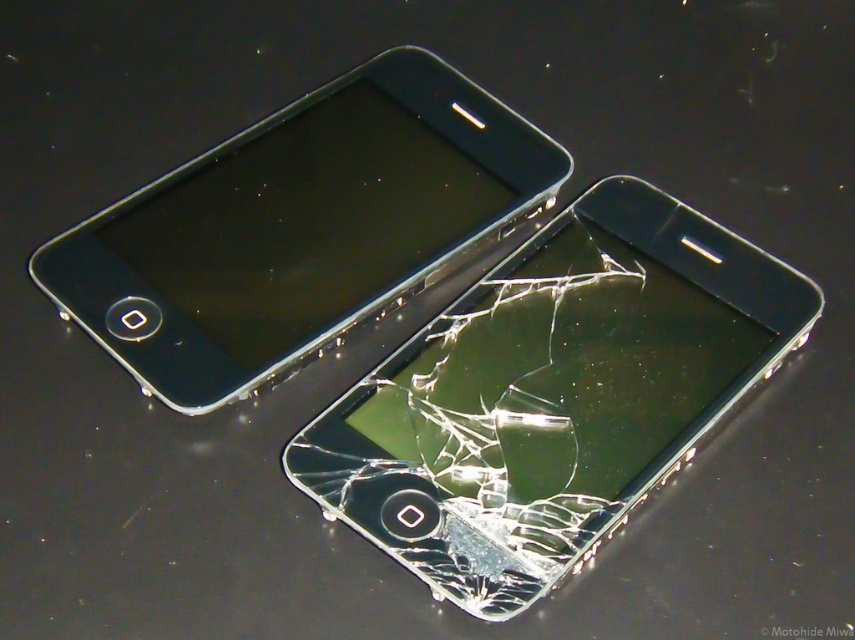
Can you confirm if transparent glass smartphone at center is positioned to the right of matte black smartphone at upper left?

Yes, transparent glass smartphone at center is to the right of matte black smartphone at upper left.

Is point (811, 308) in front of point (239, 140)?

That is True.

Who is more forward, (482, 403) or (187, 390)?

Positioned in front is point (187, 390).

Find the location of a particular element. transparent glass smartphone at center is located at coordinates (552, 394).